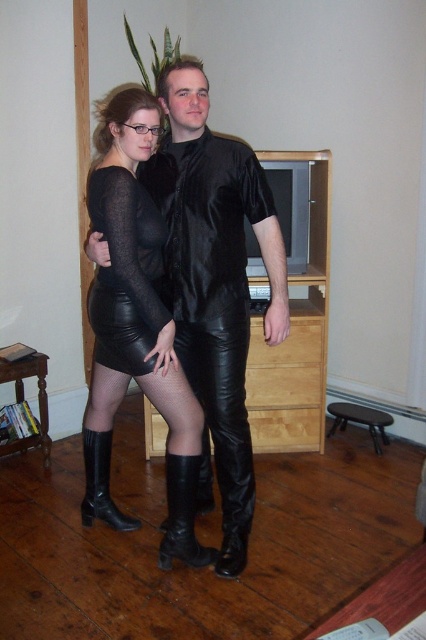
Question: Can you confirm if black leather pants at center is thinner than black leather boot at lower left?

Choices:
 (A) no
 (B) yes

Answer: (A)

Question: Which object is positioned closest to the black leather pants at center?

Choices:
 (A) black leather boot at lower left
 (B) black leather skirt at center
 (C) black leather boot at lower center

Answer: (C)

Question: Does black leather skirt at center appear on the left side of black leather boot at lower left?

Choices:
 (A) yes
 (B) no

Answer: (B)

Question: Does black leather pants at center come behind black leather boot at lower center?

Choices:
 (A) no
 (B) yes

Answer: (B)

Question: Which of these objects is positioned farthest from the black leather skirt at center?

Choices:
 (A) black leather pants at center
 (B) black leather boot at lower center

Answer: (A)

Question: Which of the following is the closest to the observer?

Choices:
 (A) (195, 461)
 (B) (247, 308)
 (C) (100, 499)

Answer: (A)